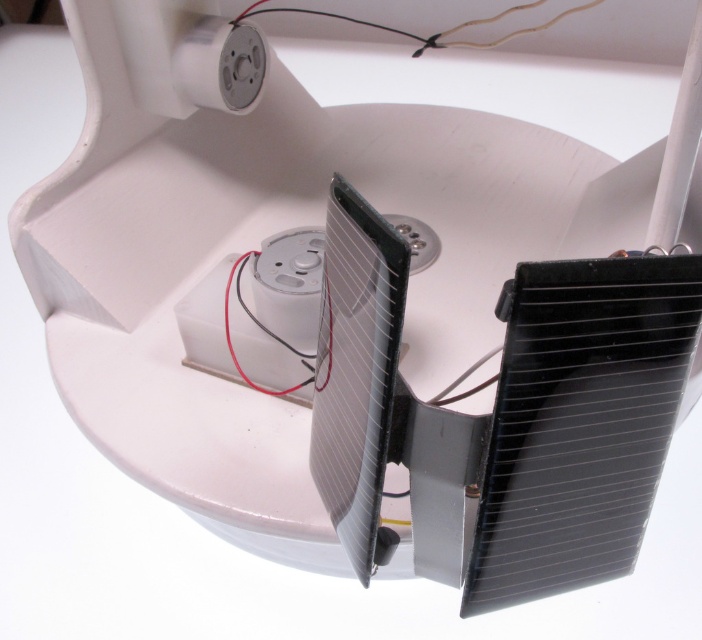
Where is the metallic silver plug at upper center located in the container?

The metallic silver plug at upper center is located at point 0.102 on the horizontal axis and 0.315 on the vertical axis within the container.

You are standing 1.5 meters away from the container. Can you reach the point at coordinates (223,24) inside the container without moving closer?

The point at coordinates (223,24) is 1.00 meters from the camera. Since you are 1.5 meters away, you are farther than the point, so you can reach it without moving closer.

What is located at the point with coordinates (220, 65) in the image?

The metallic silver plug at upper center is located at point (220, 65).